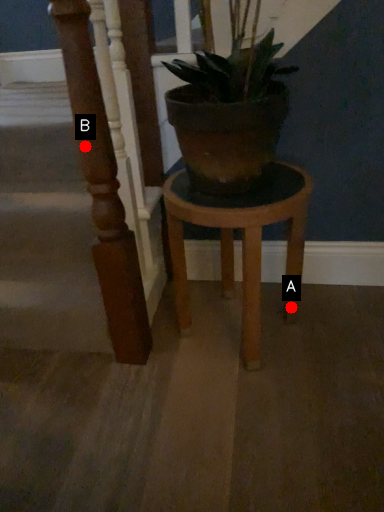
Question: Two points are circled on the image, labeled by A and B beside each circle. Which point is closer to the camera?

Choices:
 (A) A is closer
 (B) B is closer

Answer: (B)